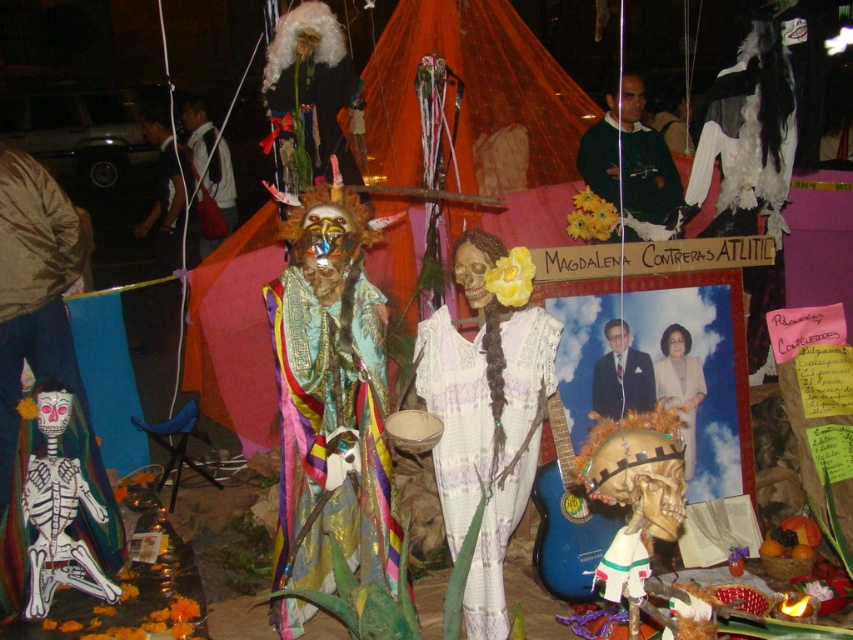
Question: Which object is closer to the camera taking this photo?

Choices:
 (A) white fluffy wig at upper center
 (B) sweater at upper center

Answer: (A)

Question: Is white fluffy wig at upper center thinner than white backpack at upper left?

Choices:
 (A) yes
 (B) no

Answer: (A)

Question: Which point is farther from the camera taking this photo?

Choices:
 (A) (619, 324)
 (B) (231, 204)

Answer: (B)

Question: Is the position of metallic gold mask at center more distant than that of white lace dress at center?

Choices:
 (A) no
 (B) yes

Answer: (B)

Question: Which point is farther from the camera taking this photo?

Choices:
 (A) (299, 128)
 (B) (315, 545)
 (C) (686, 397)
 (D) (735, 100)

Answer: (D)

Question: Does white feathered costume at upper right lie in front of formal suit at center?

Choices:
 (A) yes
 (B) no

Answer: (B)